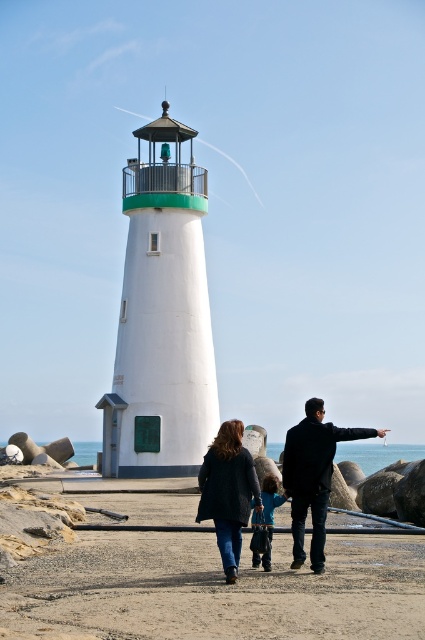
Measure the distance between black matte jacket at center and camera.

black matte jacket at center and camera are 30.85 meters apart.

Is black matte jacket at center shorter than blue fleece jacket at center?

No, black matte jacket at center is not shorter than blue fleece jacket at center.

Is point (303, 486) behind point (269, 492)?

No, (303, 486) is closer to viewer.

Locate an element on the screen. The width and height of the screenshot is (425, 640). black matte jacket at center is located at coordinates (312, 476).

Does point (342, 577) come closer to viewer compared to point (226, 493)?

No, it is behind (226, 493).

Is smooth sand at lower center smaller than dark blue coat at center?

No.

Identify the location of smooth sand at lower center. This screenshot has height=640, width=425. (215, 589).

Can you confirm if dark blue coat at center is smaller than blue fleece jacket at center?

No, dark blue coat at center is not smaller than blue fleece jacket at center.

Does dark blue coat at center have a greater width compared to blue fleece jacket at center?

Yes.

Who is more distant from viewer, (220,490) or (268,508)?

Point (268,508)

This screenshot has width=425, height=640. I want to click on dark blue coat at center, so click(227, 492).